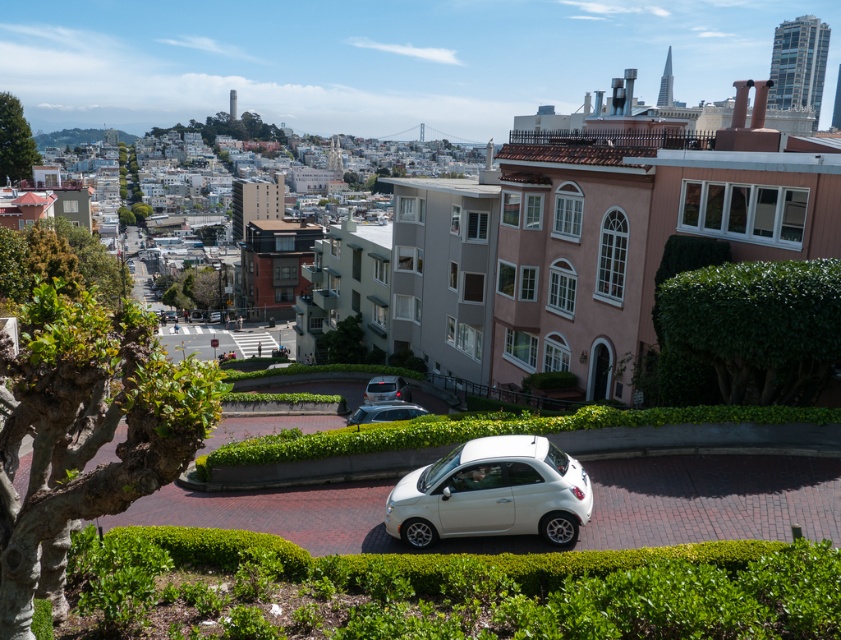
Does green leafy hedge at center have a larger size compared to satin silver car at center?

Yes, green leafy hedge at center is bigger than satin silver car at center.

Is green leafy hedge at center closer to camera compared to satin silver car at center?

Yes, green leafy hedge at center is closer to the viewer.

Measure the distance between green leafy hedge at center and camera.

green leafy hedge at center is 13.41 meters from camera.

Locate an element on the screen. Image resolution: width=841 pixels, height=640 pixels. green leafy hedge at center is located at coordinates (445, 589).

Which is in front, point (490, 499) or point (385, 396)?

Point (490, 499) is more forward.

Is white matte car at center wider than satin black car at center?

Yes, white matte car at center is wider than satin black car at center.

The height and width of the screenshot is (640, 841). Identify the location of white matte car at center. (492, 493).

This screenshot has height=640, width=841. Find the location of `white matte car at center`. white matte car at center is located at coordinates (492, 493).

Which is above, green leafy hedge at center right or satin silver car at center?

green leafy hedge at center right

Is point (784, 378) more distant than point (365, 416)?

No, (784, 378) is in front of (365, 416).

What are the coordinates of `green leafy hedge at center right` in the screenshot? It's located at (757, 324).